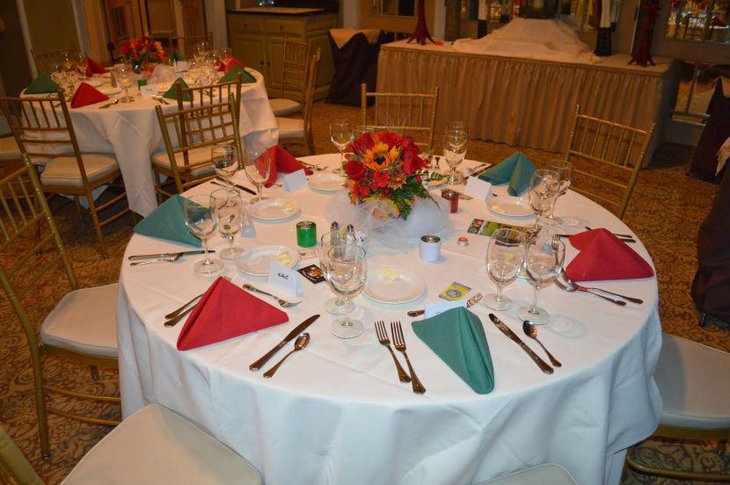
At what (x,y) coordinates should I click in order to perform the action: click on floor. Please return your answer as a coordinate pair (x, y). The width and height of the screenshot is (730, 485). Looking at the image, I should click on (683, 247).